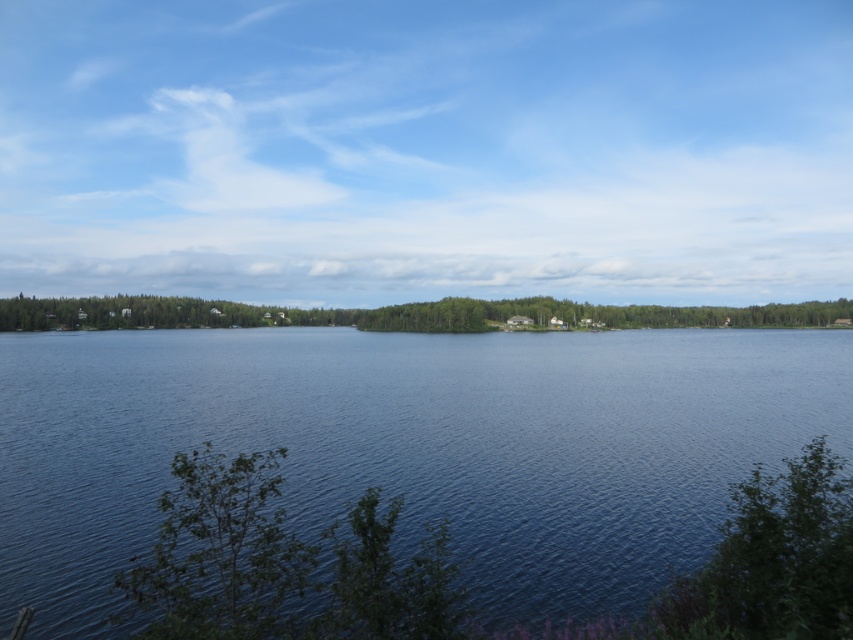
Question: Considering the relative positions of blue water at center and green leafy trees at center in the image provided, where is blue water at center located with respect to green leafy trees at center?

Choices:
 (A) below
 (B) above

Answer: (A)

Question: Is green leafy tree at lower left further to the viewer compared to green leafy trees at center?

Choices:
 (A) no
 (B) yes

Answer: (A)

Question: Which is nearer to the green leafy trees at center?

Choices:
 (A) green leafy bush at lower right
 (B) green leafy tree at lower left

Answer: (B)

Question: Which of these objects is positioned closest to the green leafy tree at lower left?

Choices:
 (A) green leafy bush at lower right
 (B) green leafy trees at center

Answer: (A)

Question: Is blue water at center bigger than green leafy trees at center?

Choices:
 (A) no
 (B) yes

Answer: (A)

Question: Among these objects, which one is farthest from the camera?

Choices:
 (A) green leafy trees at center
 (B) green leafy bush at lower right
 (C) green leafy tree at lower left

Answer: (A)